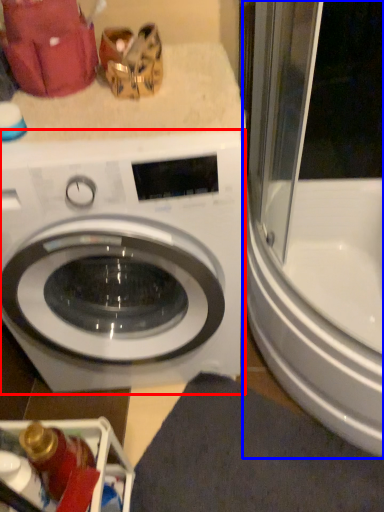
Question: Among these objects, which one is nearest to the camera, washing machine (highlighted by a red box) or screen door (highlighted by a blue box)?

Choices:
 (A) washing machine
 (B) screen door

Answer: (A)